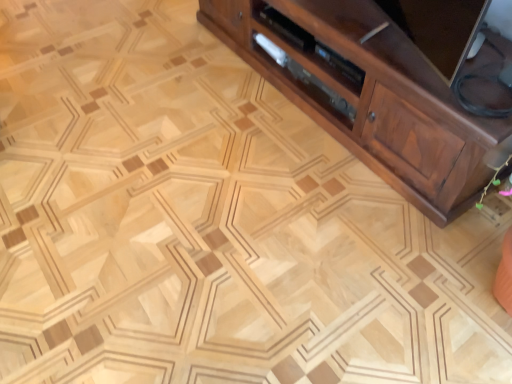
Question: Is brown wood cabinet at right taller or shorter than satin wood drawer at center?

Choices:
 (A) short
 (B) tall

Answer: (B)

Question: In the image, is brown wood cabinet at right positioned in front of or behind satin wood drawer at center?

Choices:
 (A) front
 (B) behind

Answer: (A)

Question: Is brown wood cabinet at right to the left or to the right of satin wood drawer at center in the image?

Choices:
 (A) left
 (B) right

Answer: (B)

Question: Relative to brown wood cabinet at right, is satin wood drawer at center in front or behind?

Choices:
 (A) behind
 (B) front

Answer: (A)

Question: Looking at their shapes, would you say satin wood drawer at center is wider or thinner than brown wood cabinet at right?

Choices:
 (A) thin
 (B) wide

Answer: (A)

Question: Is satin wood drawer at center taller or shorter than brown wood cabinet at right?

Choices:
 (A) short
 (B) tall

Answer: (A)

Question: Considering the positions of satin wood drawer at center and brown wood cabinet at right in the image, is satin wood drawer at center bigger or smaller than brown wood cabinet at right?

Choices:
 (A) small
 (B) big

Answer: (A)